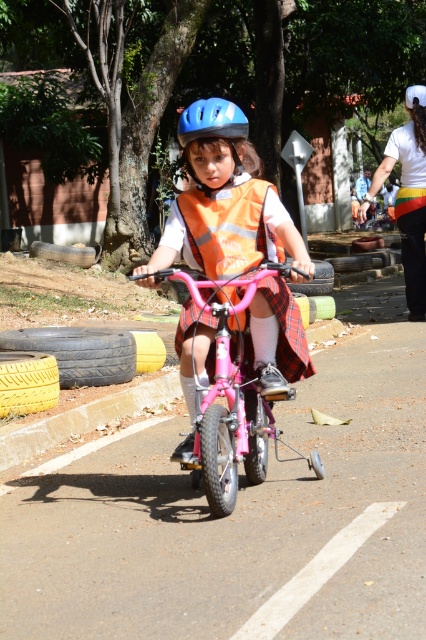
Which is below, matte orange vest at center or pink matte bicycle at center?

pink matte bicycle at center is below.

Between point (273, 205) and point (209, 428), which one is positioned in front?

Positioned in front is point (209, 428).

Image resolution: width=426 pixels, height=640 pixels. I want to click on matte orange vest at center, so click(x=224, y=200).

Does matte orange vest at center have a lesser height compared to blue matte helmet at upper center?

No, matte orange vest at center is not shorter than blue matte helmet at upper center.

How distant is matte orange vest at center from blue matte helmet at upper center?

A distance of 37.71 inches exists between matte orange vest at center and blue matte helmet at upper center.

Is point (206, 116) positioned before point (207, 131)?

Yes, point (206, 116) is closer to viewer.

Identify the location of matte orange vest at center. This screenshot has width=426, height=640. (224, 200).

Who is lower down, pink matte bicycle at center or blue matte helmet at upper center?

pink matte bicycle at center is lower down.

Who is more forward, (244, 394) or (189, 134)?

Positioned in front is point (189, 134).

Which is in front, point (201, 280) or point (201, 132)?

Point (201, 132) is more forward.

The width and height of the screenshot is (426, 640). I want to click on pink matte bicycle at center, so click(x=229, y=396).